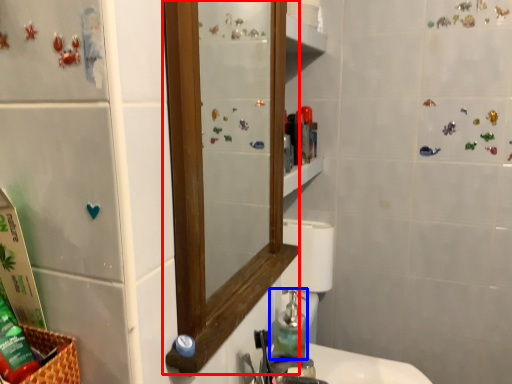
Question: Which of the following is the closest to the observer, mirror (highlighted by a red box) or soap dispenser (highlighted by a blue box)?

Choices:
 (A) mirror
 (B) soap dispenser

Answer: (A)